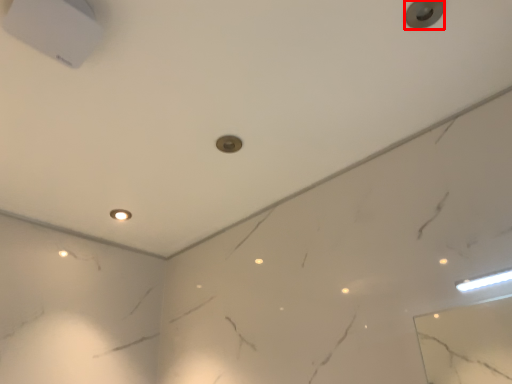
Question: From the image, what is the correct spatial relationship of knob (annotated by the red box) in relation to dot?

Choices:
 (A) left
 (B) right

Answer: (B)